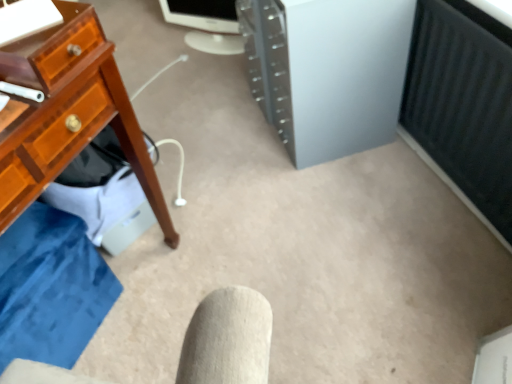
Question: Is satin silver tower at center in front of or behind white glossy monitor at upper center in the image?

Choices:
 (A) behind
 (B) front

Answer: (B)

Question: In terms of size, does satin silver tower at center appear bigger or smaller than white glossy monitor at upper center?

Choices:
 (A) big
 (B) small

Answer: (A)

Question: Is satin silver tower at center wider or thinner than white glossy monitor at upper center?

Choices:
 (A) wide
 (B) thin

Answer: (A)

Question: Is white glossy monitor at upper center wider or thinner than satin silver tower at center?

Choices:
 (A) wide
 (B) thin

Answer: (B)

Question: From a real-world perspective, is white glossy monitor at upper center physically located above or below satin silver tower at center?

Choices:
 (A) above
 (B) below

Answer: (B)

Question: Is white glossy monitor at upper center situated inside satin silver tower at center or outside?

Choices:
 (A) outside
 (B) inside

Answer: (A)

Question: From the image's perspective, is white glossy monitor at upper center positioned above or below satin silver tower at center?

Choices:
 (A) above
 (B) below

Answer: (A)